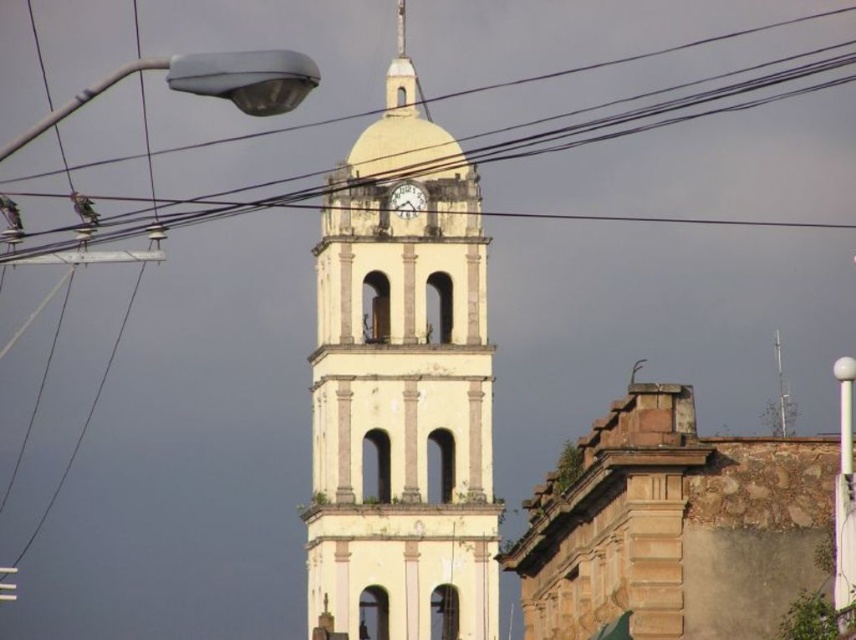
Question: Is the position of black wire at upper center more distant than that of white glossy pole at upper right?

Choices:
 (A) yes
 (B) no

Answer: (A)

Question: Does smooth white spire at upper center have a smaller size compared to white glossy clock at center?

Choices:
 (A) yes
 (B) no

Answer: (B)

Question: Is black wire at upper center positioned before white glossy clock at center?

Choices:
 (A) no
 (B) yes

Answer: (B)

Question: Which point appears closest to the camera in this image?

Choices:
 (A) (314, 480)
 (B) (400, 12)

Answer: (A)

Question: Which point appears closest to the camera in this image?

Choices:
 (A) click(397, 205)
 (B) click(399, 109)
 (C) click(568, 561)

Answer: (C)

Question: Among these objects, which one is nearest to the camera?

Choices:
 (A) white glossy clock at center
 (B) smooth white spire at upper center

Answer: (A)